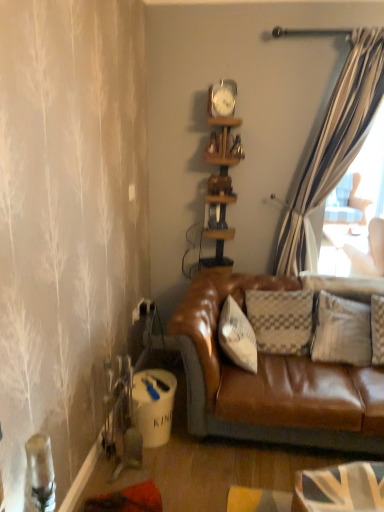
Question: From a real-world perspective, is wooden shelf at center, the first shelf in the bottom-to-top sequence, on top of wooden clock at upper center, placed as the second shelf when sorted from bottom to top?

Choices:
 (A) no
 (B) yes

Answer: (A)

Question: Does wooden shelf at center, which appears as the 2th shelf when viewed from the top, come behind wooden clock at upper center, which is counted as the first shelf, starting from the top?

Choices:
 (A) no
 (B) yes

Answer: (A)

Question: Is wooden shelf at center, the first shelf in the bottom-to-top sequence, far from wooden clock at upper center, which is counted as the first shelf, starting from the top?

Choices:
 (A) no
 (B) yes

Answer: (A)

Question: From the image's perspective, is wooden shelf at center, the first shelf in the bottom-to-top sequence, below wooden clock at upper center, placed as the second shelf when sorted from bottom to top?

Choices:
 (A) yes
 (B) no

Answer: (A)

Question: Is wooden shelf at center, which appears as the 2th shelf when viewed from the top, turned away from wooden clock at upper center, which is counted as the first shelf, starting from the top?

Choices:
 (A) yes
 (B) no

Answer: (A)

Question: Is wooden shelf at center, the first shelf in the bottom-to-top sequence, spatially inside metallic silver clock at upper center, or outside of it?

Choices:
 (A) outside
 (B) inside

Answer: (A)

Question: Is wooden shelf at center, which appears as the 2th shelf when viewed from the top, wider or thinner than metallic silver clock at upper center?

Choices:
 (A) thin
 (B) wide

Answer: (B)

Question: From the image's perspective, is wooden shelf at center, which appears as the 2th shelf when viewed from the top, located above or below metallic silver clock at upper center?

Choices:
 (A) below
 (B) above

Answer: (A)

Question: Is wooden shelf at center, the first shelf in the bottom-to-top sequence, to the left or to the right of metallic silver clock at upper center in the image?

Choices:
 (A) left
 (B) right

Answer: (B)

Question: Is wooden clock at upper center, which is counted as the first shelf, starting from the top, to the left or to the right of wooden shelf at center, which appears as the 2th shelf when viewed from the top, in the image?

Choices:
 (A) right
 (B) left

Answer: (A)

Question: From the image's perspective, is wooden clock at upper center, placed as the second shelf when sorted from bottom to top, located above or below wooden shelf at center, which appears as the 2th shelf when viewed from the top?

Choices:
 (A) below
 (B) above

Answer: (B)

Question: Considering the positions of wooden clock at upper center, which is counted as the first shelf, starting from the top, and wooden shelf at center, the first shelf in the bottom-to-top sequence, in the image, is wooden clock at upper center, which is counted as the first shelf, starting from the top, taller or shorter than wooden shelf at center, the first shelf in the bottom-to-top sequence,?

Choices:
 (A) short
 (B) tall

Answer: (A)

Question: Considering the positions of point (218, 157) and point (226, 146), is point (218, 157) closer or farther from the camera than point (226, 146)?

Choices:
 (A) farther
 (B) closer

Answer: (A)

Question: Is wooden clock at upper center, placed as the second shelf when sorted from bottom to top, wider or thinner than metallic silver clock at upper center?

Choices:
 (A) thin
 (B) wide

Answer: (B)

Question: From the image's perspective, is wooden clock at upper center, placed as the second shelf when sorted from bottom to top, above or below metallic silver clock at upper center?

Choices:
 (A) below
 (B) above

Answer: (A)